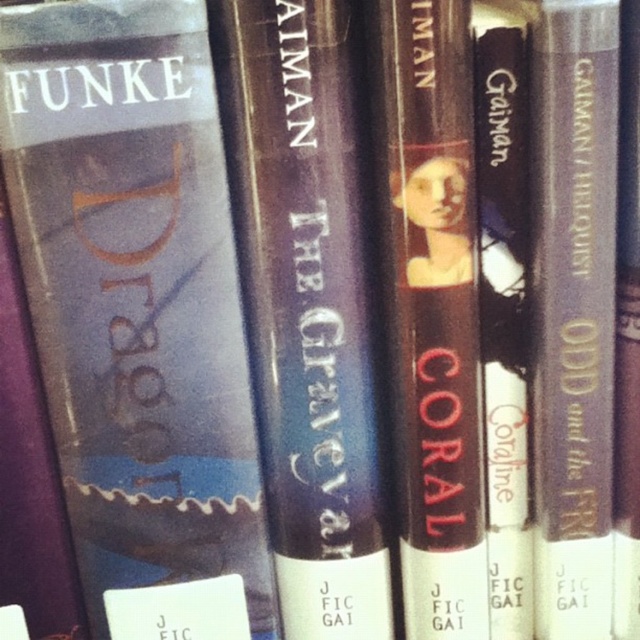
You are standing 2 feet away from a bookshelf. There is a matte blue book at center. Can you reach it without moving closer?

The matte blue book at center is 21.95 inches from the viewer. Since you are standing 2 feet away, which is 24 inches, you are already closer than the required distance. Therefore, you can reach the matte blue book at center without needing to move closer.

You are organizing books on a shelf and need to place a new book that requires 12 inches of space between it and the next book. Looking at the shelf with the matte blue book at center and the matte purple book at right, do you have enough space between them to fit your new book?

The distance between the matte blue book at center and the matte purple book at right is 11.05 inches, which is less than the required 12 inches. Therefore, there isn not enough space to fit the new book between them.